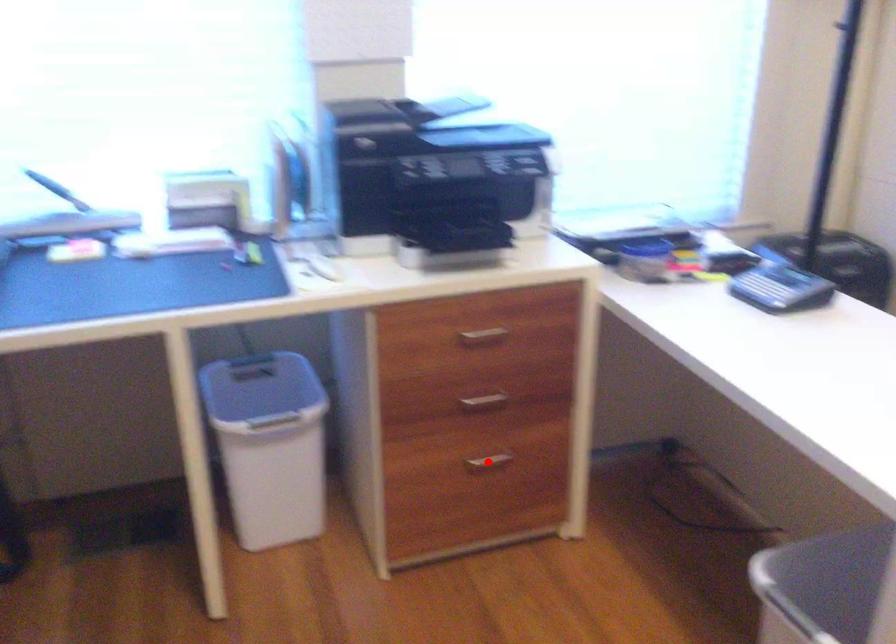
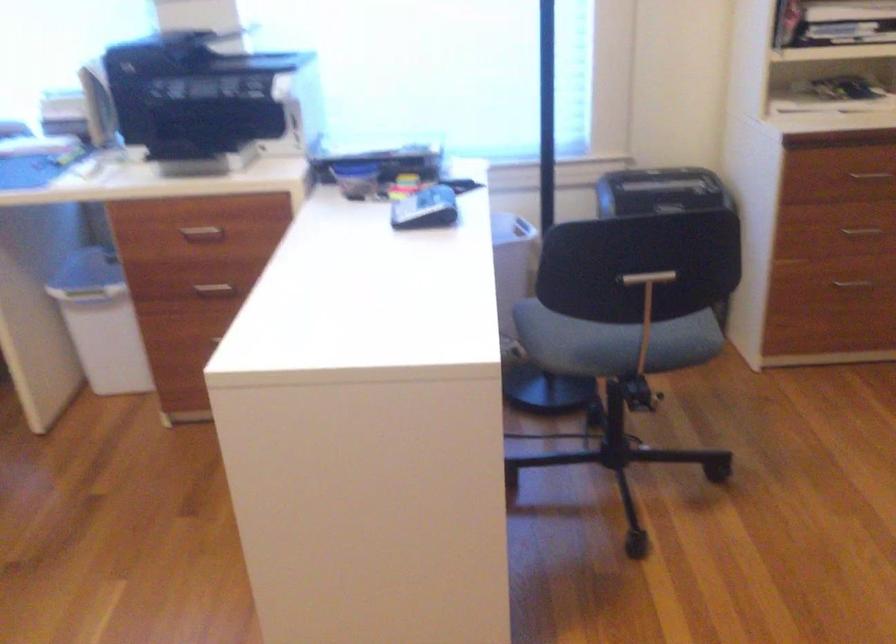
Question: I am providing you with two images of the same scene from different viewpoints. A red point is marked on the first image. Can you still see the location of the red point in image 2?

Choices:
 (A) Yes
 (B) No

Answer: (B)